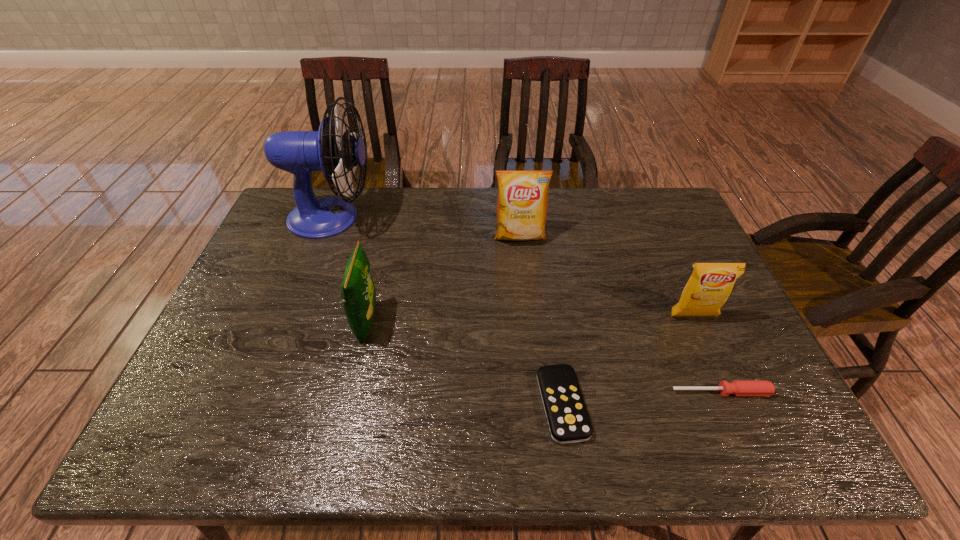
Identify the location of the tallest object. (333, 150).

The image size is (960, 540). Find the location of `the leftmost object`. the leftmost object is located at coordinates pos(333,150).

Where is `the second crisp (potato chip) from left to right`? Image resolution: width=960 pixels, height=540 pixels. the second crisp (potato chip) from left to right is located at coordinates (522, 204).

What are the coordinates of `the second object from left to right` in the screenshot? It's located at (358, 292).

Locate an element on the screen. This screenshot has width=960, height=540. the rightmost crisp (potato chip) is located at coordinates (708, 288).

Locate an element on the screen. This screenshot has width=960, height=540. screwdriver is located at coordinates (738, 387).

The width and height of the screenshot is (960, 540). Find the location of `remote control`. remote control is located at coordinates (568, 420).

Locate an element on the screen. Image resolution: width=960 pixels, height=540 pixels. vacant space located 0.270m in front of the fan where the airflow is directed is located at coordinates (454, 218).

Identify the location of free space located on the front-facing side of the farthest crisp (potato chip). This screenshot has width=960, height=540. (525, 290).

Where is `free region located on the front-facing side of the leftmost crisp (potato chip)`? This screenshot has width=960, height=540. free region located on the front-facing side of the leftmost crisp (potato chip) is located at coordinates (456, 322).